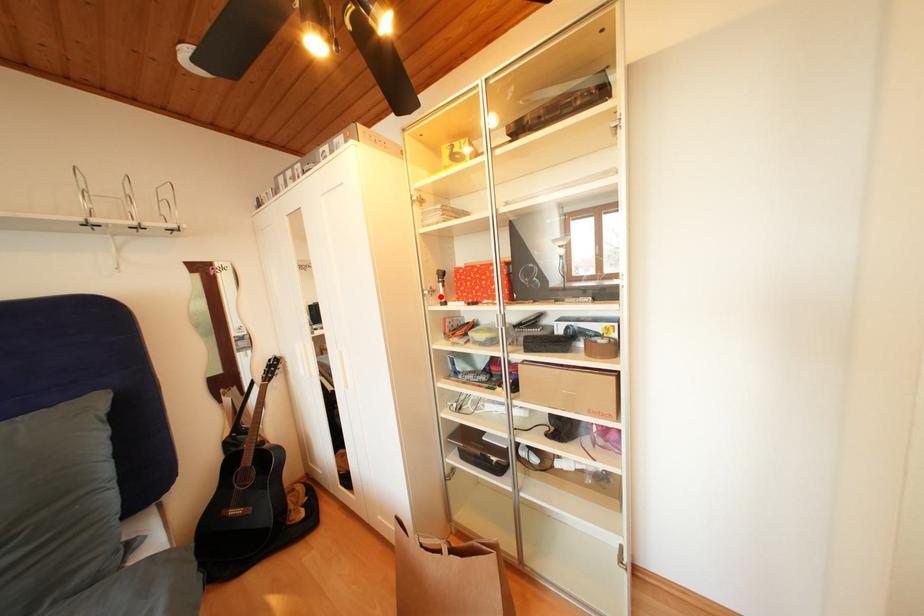
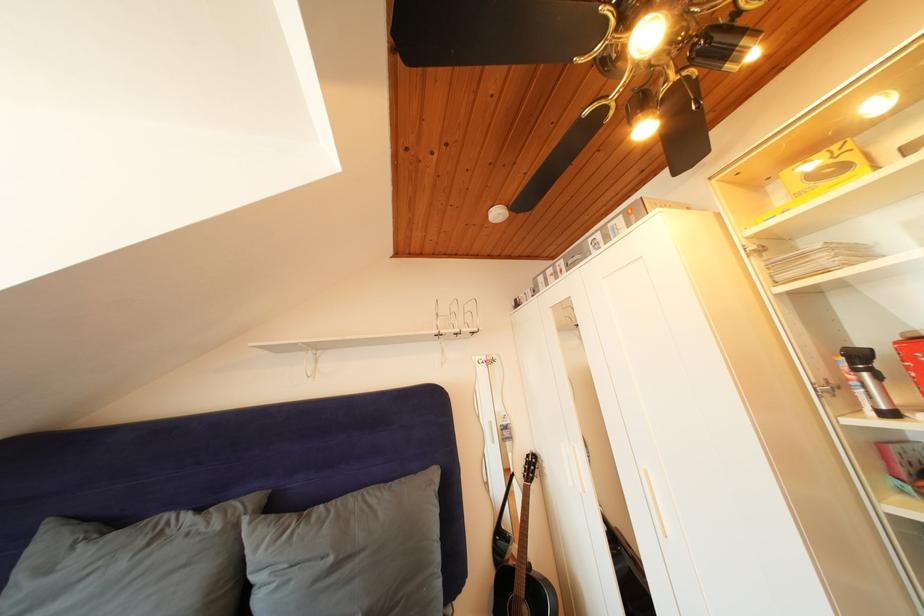
Locate, in the second image, the point that corresponds to the highlighted location in the first image.

(844, 392)